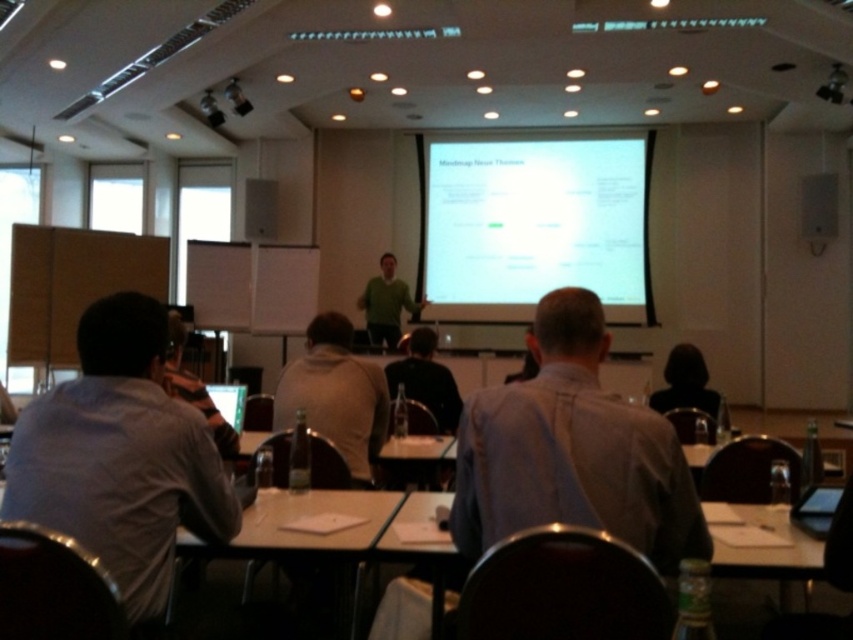
Question: Can you confirm if gray shirt at left is positioned above white paper at lower center?

Choices:
 (A) no
 (B) yes

Answer: (B)

Question: Which of the following is the closest to the observer?

Choices:
 (A) (816, 605)
 (B) (277, 406)
 (C) (158, 330)
 (D) (616, 424)

Answer: (D)

Question: Considering the real-world distances, which object is closest to the black plastic projector at upper right?

Choices:
 (A) green matte sweater at center
 (B) white paper at center
 (C) light blue shirt at center

Answer: (B)

Question: Which of the following is the farthest from the observer?

Choices:
 (A) (669, 534)
 (B) (613, 198)
 (C) (836, 76)
 (D) (381, 307)

Answer: (B)

Question: Is white matte projection screen at upper center behind white paper at center?

Choices:
 (A) no
 (B) yes

Answer: (B)

Question: Can you confirm if gray cotton shirt at center is positioned above green matte sweater at center?

Choices:
 (A) yes
 (B) no

Answer: (B)